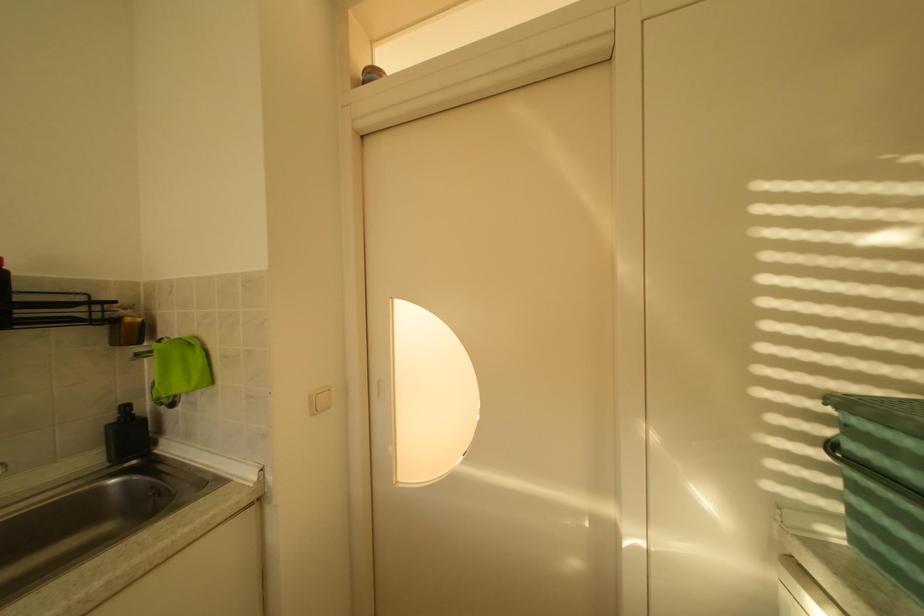
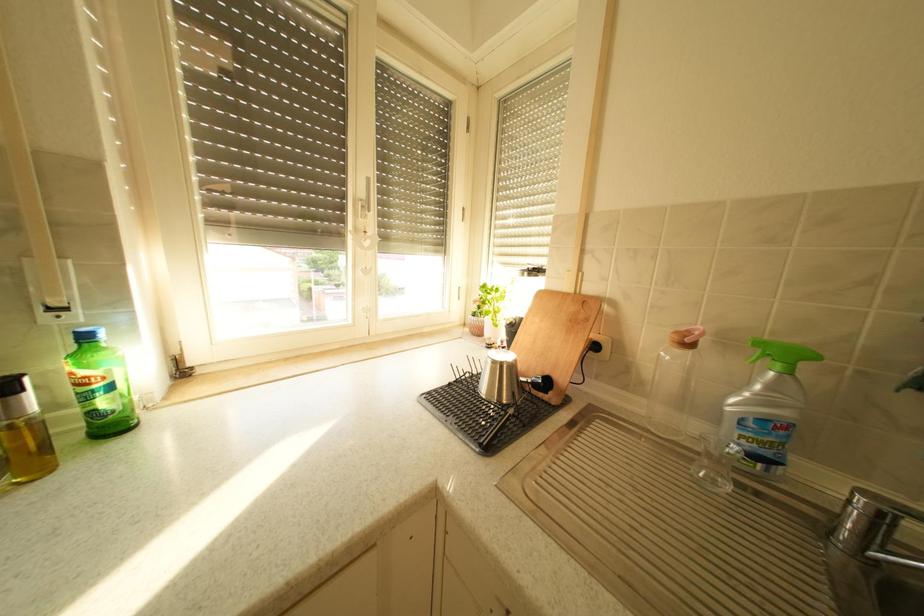
Question: The camera is either moving clockwise (left) or counter-clockwise (right) around the object. The first image is from the beginning of the video and the second image is from the end. Is the camera moving left or right when shooting the video?

Choices:
 (A) Left
 (B) Right

Answer: (B)